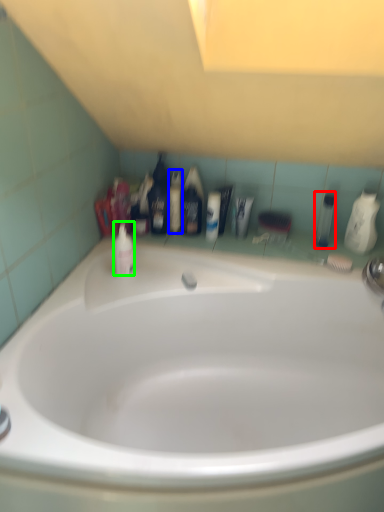
Question: Considering the real-world distances, which object is farthest from mouthwash (highlighted by a red box)? mouthwash (highlighted by a blue box) or mouthwash (highlighted by a green box)?

Choices:
 (A) mouthwash
 (B) mouthwash

Answer: (B)